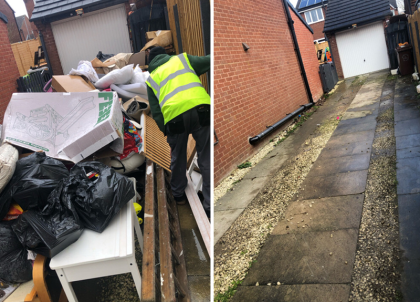
Image resolution: width=420 pixels, height=302 pixels. What are the coordinates of `brown wood ladder` in the screenshot? It's located at (160, 211), (149, 236).